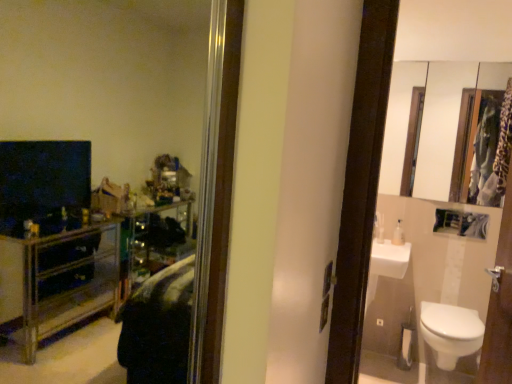
Question: Is clear plastic bottle at right looking in the opposite direction of white glossy toilet at lower right?

Choices:
 (A) yes
 (B) no

Answer: (B)

Question: Is the depth of clear plastic bottle at right greater than that of white glossy toilet at lower right?

Choices:
 (A) no
 (B) yes

Answer: (B)

Question: Is clear plastic bottle at right completely or partially outside of white glossy toilet at lower right?

Choices:
 (A) yes
 (B) no

Answer: (A)

Question: Can you confirm if clear plastic bottle at right is positioned to the right of white glossy toilet at lower right?

Choices:
 (A) yes
 (B) no

Answer: (B)

Question: Can you confirm if clear plastic bottle at right is smaller than white glossy toilet at lower right?

Choices:
 (A) no
 (B) yes

Answer: (B)

Question: Considering their positions, is clear plastic bottle at right located in front of or behind white glossy mirror at upper right?

Choices:
 (A) front
 (B) behind

Answer: (B)

Question: From the image's perspective, is clear plastic bottle at right positioned above or below white glossy mirror at upper right?

Choices:
 (A) above
 (B) below

Answer: (B)

Question: Is clear plastic bottle at right bigger or smaller than white glossy mirror at upper right?

Choices:
 (A) small
 (B) big

Answer: (A)

Question: In terms of width, does clear plastic bottle at right look wider or thinner when compared to white glossy mirror at upper right?

Choices:
 (A) wide
 (B) thin

Answer: (A)

Question: In terms of width, does clear plastic bottle at right look wider or thinner when compared to white glossy toilet at lower right?

Choices:
 (A) thin
 (B) wide

Answer: (A)

Question: Is clear plastic bottle at right to the left or to the right of white glossy toilet at lower right in the image?

Choices:
 (A) right
 (B) left

Answer: (B)

Question: From the image's perspective, is clear plastic bottle at right positioned above or below white glossy toilet at lower right?

Choices:
 (A) below
 (B) above

Answer: (B)

Question: Based on their sizes in the image, would you say clear plastic bottle at right is bigger or smaller than white glossy toilet at lower right?

Choices:
 (A) small
 (B) big

Answer: (A)

Question: From their relative heights in the image, would you say white glossy mirror at upper right is taller or shorter than clear plastic bottle at right?

Choices:
 (A) short
 (B) tall

Answer: (B)

Question: From the image's perspective, is white glossy mirror at upper right above or below clear plastic bottle at right?

Choices:
 (A) below
 (B) above

Answer: (B)